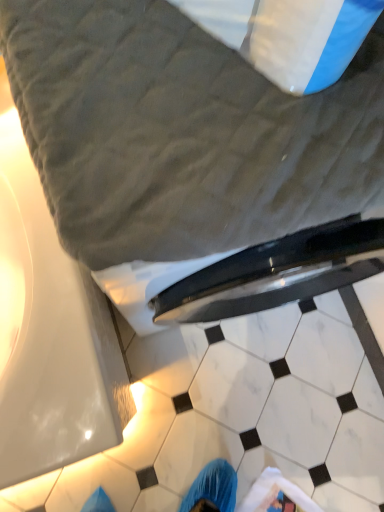
Question: From a real-world perspective, is gray quilted bed at upper center above or below white marble tile at lower center, which appears as the 2th tile when viewed from the front?

Choices:
 (A) below
 (B) above

Answer: (B)

Question: From the image's perspective, relative to white marble tile at lower center, acting as the 1th tile starting from the back, is gray quilted bed at upper center above or below?

Choices:
 (A) below
 (B) above

Answer: (B)

Question: Which object is positioned closest to the white marble tile at lower center, acting as the 1th tile starting from the back?

Choices:
 (A) white marble tile at center, acting as the first tile starting from the front
 (B) gray quilted bed at upper center

Answer: (A)

Question: Which object is positioned farthest from the white marble tile at lower center, which appears as the 2th tile when viewed from the front?

Choices:
 (A) gray quilted bed at upper center
 (B) white marble tile at center, acting as the first tile starting from the front

Answer: (A)